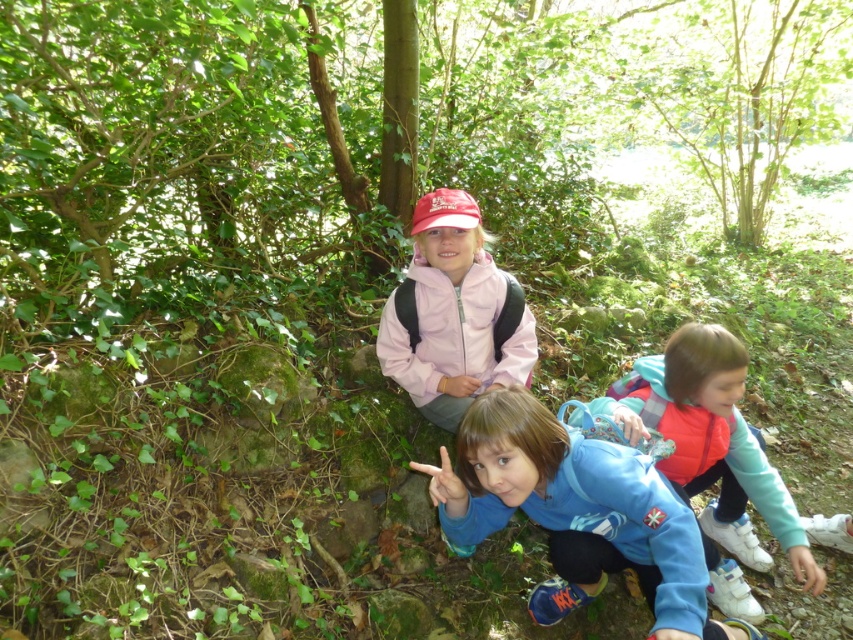
You are a photographer trying to capture a group photo of the children. Since the blue fleece jacket at center and the pink matte jacket at center are both in the center, which one should you adjust to ensure both are visible in the frame?

Since the blue fleece jacket at center is larger in size than the pink matte jacket at center, you should adjust the blue fleece jacket at center to make more space for both to fit into the frame.

You are planning to set up a picnic blanket between the blue fleece jacket at center and the green leafy tree at upper center. The picnic blanket requires a space of 20 feet. Will there be enough space between them?

The distance between the blue fleece jacket at center and the green leafy tree at upper center is 23.00 feet, which is more than enough to accommodate the 20 feet required for the picnic blanket.

Based on the scene description, where is the green leafy tree at upper center located in the image?

The green leafy tree at upper center is located at the 2D coordinates point (747,93) in the image.